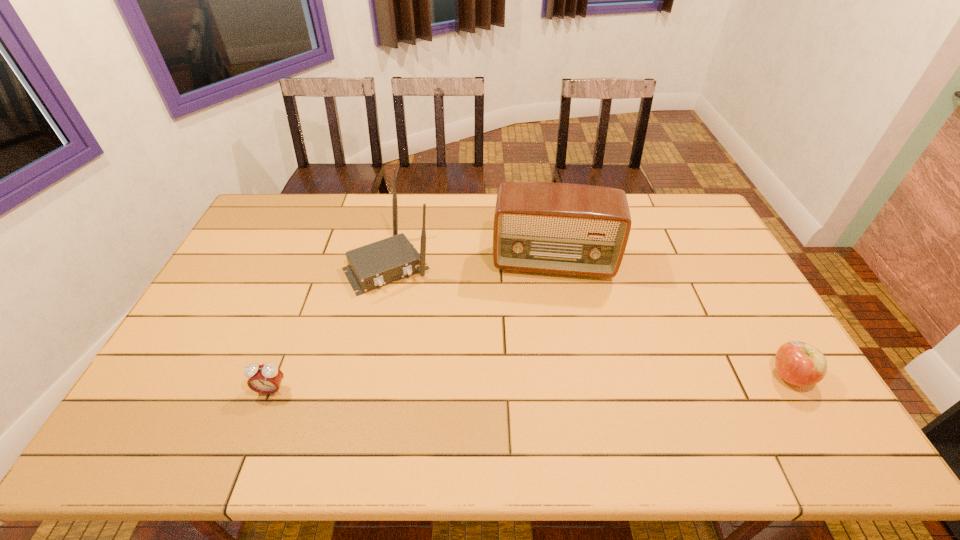
Locate an element on the screen. The width and height of the screenshot is (960, 540). free space located 0.120m on the back of the third object from right to left to connect cables is located at coordinates (423, 318).

Locate an element on the screen. alarm clock that is positioned at the near edge is located at coordinates (265, 379).

Where is `apple at the near edge`? Image resolution: width=960 pixels, height=540 pixels. apple at the near edge is located at coordinates (798, 363).

Find the location of `object at the right edge`. object at the right edge is located at coordinates (798, 363).

The width and height of the screenshot is (960, 540). In order to click on object located at the near right corner in this screenshot , I will do point(798,363).

The width and height of the screenshot is (960, 540). In the image, there is a desktop. Find the location of `vacant space at the far edge`. vacant space at the far edge is located at coordinates (334, 201).

Locate an element on the screen. The height and width of the screenshot is (540, 960). vacant region at the near edge of the desktop is located at coordinates (669, 379).

Where is `free location at the left edge of the desktop`? The width and height of the screenshot is (960, 540). free location at the left edge of the desktop is located at coordinates (234, 304).

Where is `vacant space at the right edge`? This screenshot has width=960, height=540. vacant space at the right edge is located at coordinates (751, 300).

This screenshot has height=540, width=960. I want to click on vacant space at the far right corner of the desktop, so click(669, 231).